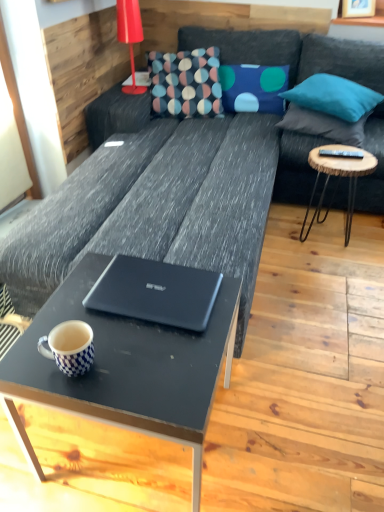
Question: Could you tell me if matte red lamp at upper left is facing wooden round side table at right?

Choices:
 (A) no
 (B) yes

Answer: (A)

Question: Is matte red lamp at upper left not within wooden round side table at right?

Choices:
 (A) yes
 (B) no

Answer: (A)

Question: Does matte red lamp at upper left have a lesser width compared to wooden round side table at right?

Choices:
 (A) yes
 (B) no

Answer: (A)

Question: Is matte red lamp at upper left taller than wooden round side table at right?

Choices:
 (A) yes
 (B) no

Answer: (B)

Question: From a real-world perspective, is matte red lamp at upper left over wooden round side table at right?

Choices:
 (A) no
 (B) yes

Answer: (B)

Question: Considering their positions, is blue fabric pillow at upper right, the first pillow positioned from the left, located in front of or behind matte black coffee table at center?

Choices:
 (A) front
 (B) behind

Answer: (B)

Question: From a real-world perspective, is blue fabric pillow at upper right, which is counted as the third pillow, starting from the right, positioned above or below matte black coffee table at center?

Choices:
 (A) above
 (B) below

Answer: (A)

Question: Choose the correct answer: Is blue fabric pillow at upper right, which is counted as the third pillow, starting from the right, inside matte black coffee table at center or outside it?

Choices:
 (A) inside
 (B) outside

Answer: (B)

Question: From the image's perspective, is blue fabric pillow at upper right, the first pillow positioned from the left, located above or below matte black coffee table at center?

Choices:
 (A) below
 (B) above

Answer: (B)

Question: From a real-world perspective, is white checkered mug at lower left physically located above or below multicolored fabric pillow at center?

Choices:
 (A) above
 (B) below

Answer: (B)

Question: Is point (57, 352) positioned closer to the camera than point (206, 100)?

Choices:
 (A) farther
 (B) closer

Answer: (B)

Question: From their relative heights in the image, would you say white checkered mug at lower left is taller or shorter than multicolored fabric pillow at center?

Choices:
 (A) tall
 (B) short

Answer: (B)

Question: In the image, is white checkered mug at lower left positioned in front of or behind multicolored fabric pillow at center?

Choices:
 (A) behind
 (B) front

Answer: (B)

Question: Is matte black coffee table at center inside the boundaries of teal fabric pillow at upper right, which appears as the first pillow when viewed from the right, or outside?

Choices:
 (A) inside
 (B) outside

Answer: (B)

Question: From the image's perspective, relative to teal fabric pillow at upper right, positioned as the 3th pillow in left-to-right order, is matte black coffee table at center above or below?

Choices:
 (A) above
 (B) below

Answer: (B)